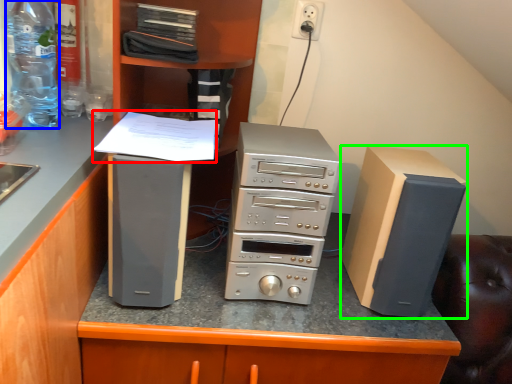
Question: Estimate the real-world distances between objects in this image. Which object is closer to paper (highlighted by a red box), bottle (highlighted by a blue box) or computer tower (highlighted by a green box)?

Choices:
 (A) bottle
 (B) computer tower

Answer: (A)